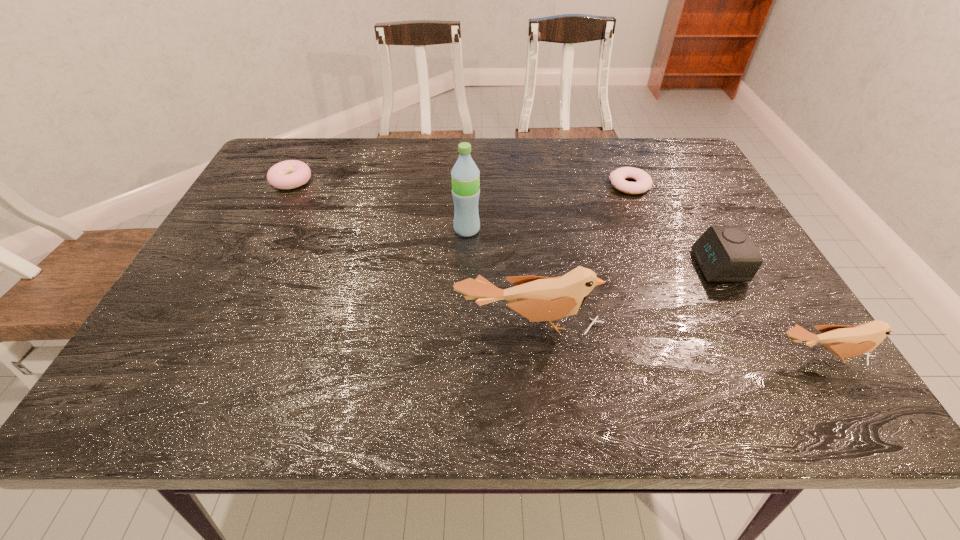
Considering the uniform spacing of birds, where should an additional bird be positioned on the left? Please locate a free spot. Please provide its 2D coordinates. Your answer should be formatted as a tuple, i.e. [(x, y)], where the tuple contains the x and y coordinates of a point satisfying the conditions above.

[(272, 295)]